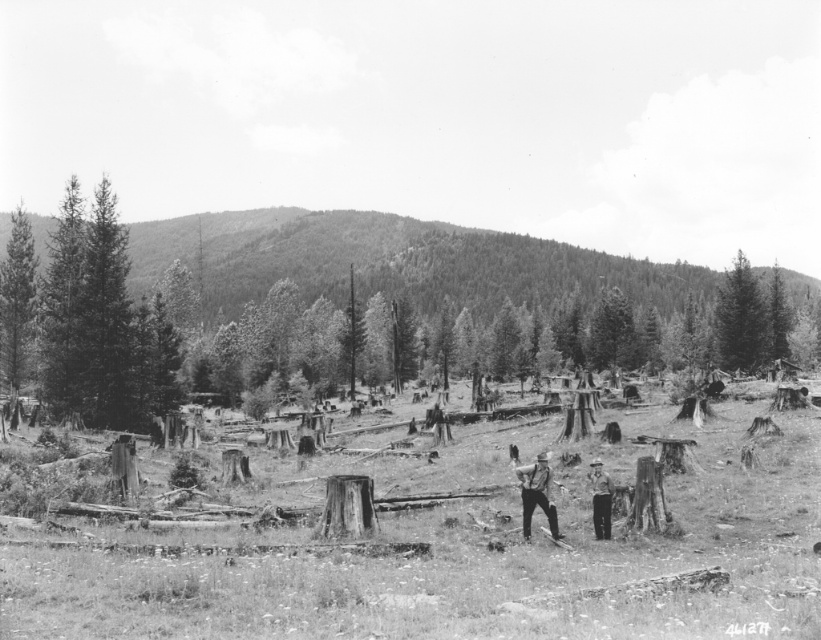
Question: Does wooden stumps at center appear on the left side of smooth green tree at upper right?

Choices:
 (A) no
 (B) yes

Answer: (B)

Question: Is smooth green hillside at upper left below matte black overalls at center?

Choices:
 (A) no
 (B) yes

Answer: (A)

Question: Among these points, which one is nearest to the camera?

Choices:
 (A) (222, 307)
 (B) (24, 305)

Answer: (B)

Question: Considering the real-world distances, which object is farthest from the matte black overalls at center?

Choices:
 (A) smooth bark tree at left
 (B) smooth green hillside at upper left
 (C) smooth green tree at upper right

Answer: (B)

Question: Among these points, which one is farthest from the camera?

Choices:
 (A) (595, 509)
 (B) (3, 273)
 (C) (759, 355)

Answer: (C)

Question: Observing the image, what is the correct spatial positioning of wooden stumps at center in reference to light brown wooden stick at center?

Choices:
 (A) left
 (B) right

Answer: (A)